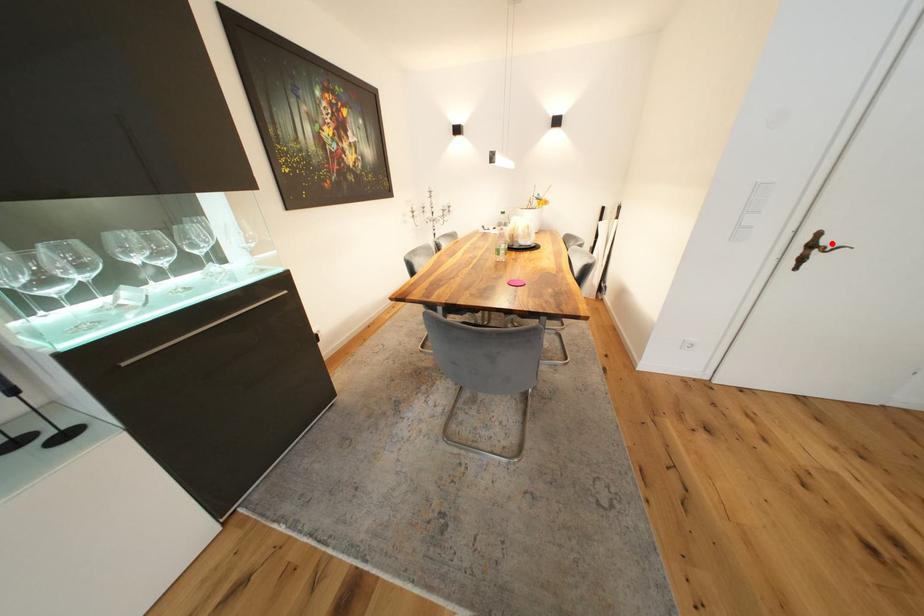
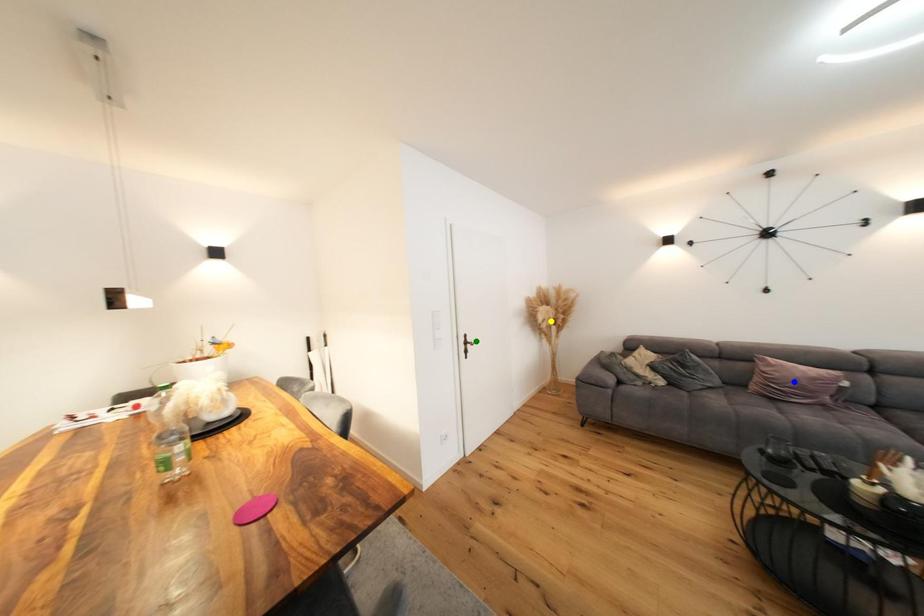
Question: I am providing you with two images of the same scene from different viewpoints. A red point is marked on the first image. You are given multiple points on the second image. In image 2, which mark is for the same physical point as the one in image 1?

Choices:
 (A) blue point
 (B) yellow point
 (C) green point

Answer: (C)